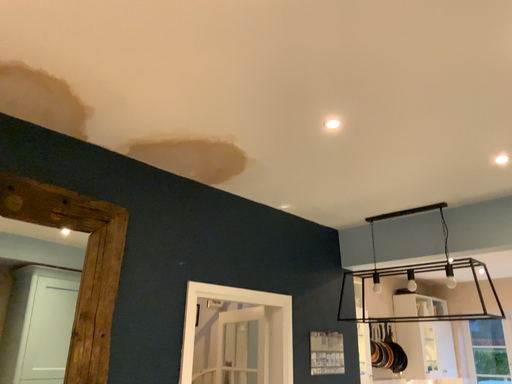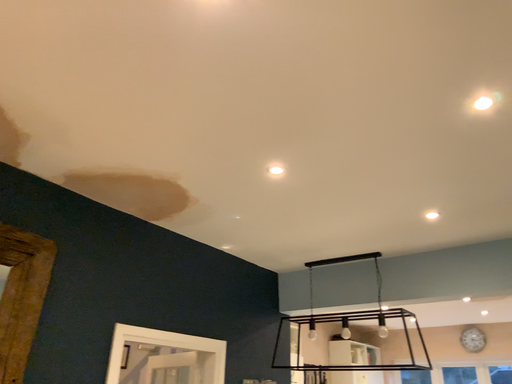
Question: Which way did the camera rotate in the video?

Choices:
 (A) rotated left
 (B) rotated right

Answer: (B)